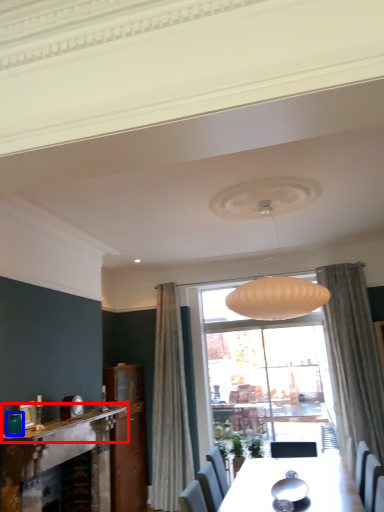
Question: Which object is further to the camera taking this photo, mantle (highlighted by a red box) or teal (highlighted by a blue box)?

Choices:
 (A) mantle
 (B) teal

Answer: (B)